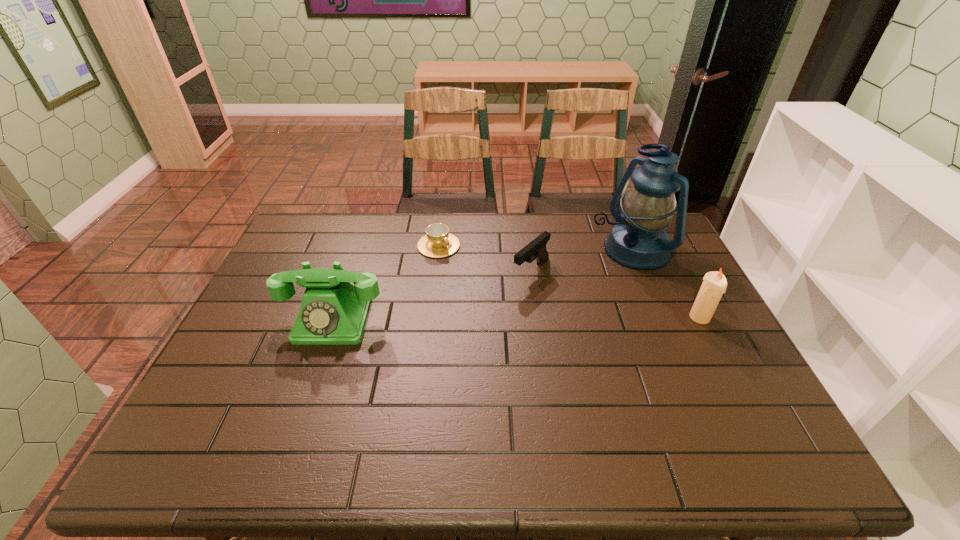
Image resolution: width=960 pixels, height=540 pixels. I want to click on the leftmost object, so click(x=333, y=311).

Identify the location of candle. The height and width of the screenshot is (540, 960). (714, 284).

Locate an element on the screen. The image size is (960, 540). the shortest object is located at coordinates (438, 242).

The width and height of the screenshot is (960, 540). In order to click on cup in this screenshot , I will do `click(438, 242)`.

The height and width of the screenshot is (540, 960). In order to click on the third object from right to left in this screenshot , I will do `click(536, 249)`.

You are a GUI agent. You are given a task and a screenshot of the screen. Output one action in this format:
    pyautogui.click(x=<x>, y=<y>)
    Task: Click on the fourth tallest object
    Image resolution: width=960 pixels, height=540 pixels.
    Given the screenshot: What is the action you would take?
    pyautogui.click(x=536, y=249)

Where is `the tallest object`? This screenshot has width=960, height=540. the tallest object is located at coordinates (638, 240).

Where is `free space located 0.170m on the dial of the leftmost object`? This screenshot has height=540, width=960. free space located 0.170m on the dial of the leftmost object is located at coordinates (305, 401).

Identify the location of vacant space located on the front of the candle. Image resolution: width=960 pixels, height=540 pixels. (744, 404).

Find the location of a particular element. Image resolution: width=960 pixels, height=540 pixels. vacant space located 0.350m with the handle on the side of the fourth object from right to left is located at coordinates [x=523, y=316].